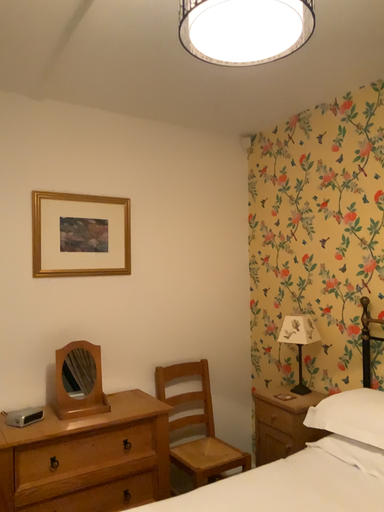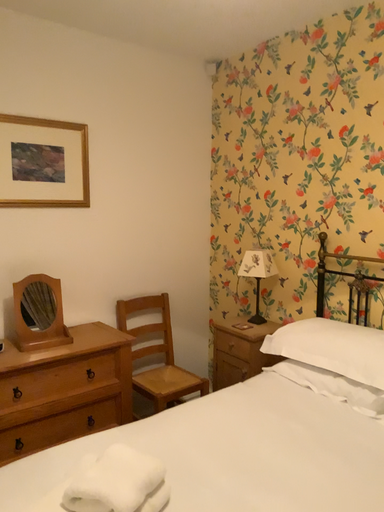
Question: How did the camera likely rotate when shooting the video?

Choices:
 (A) rotated left
 (B) rotated right

Answer: (B)